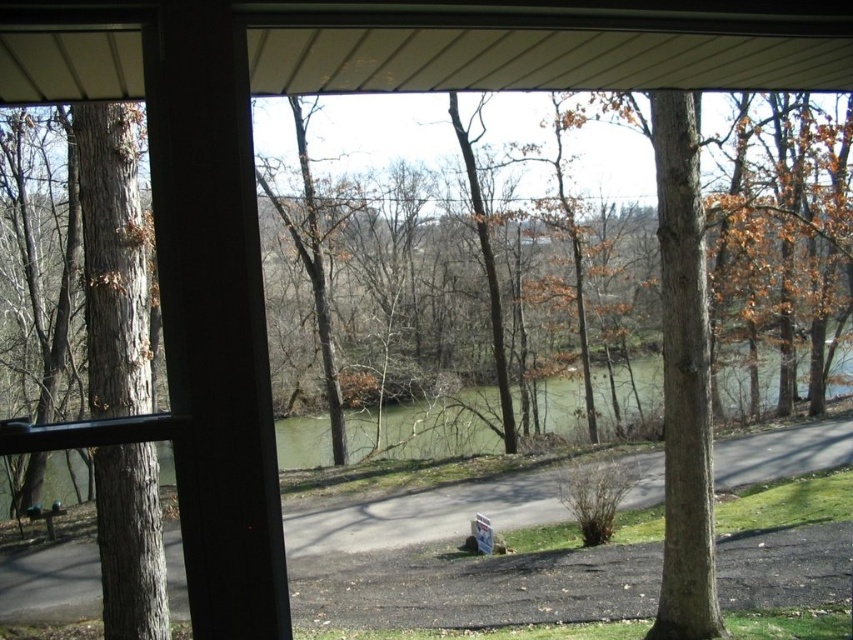
In the scene shown: You are standing inside a modern structure looking out through a window. You see a gray bark tree at left and a green grassy lake at center. Which object is closer to the window?

The gray bark tree at left is closer to the window because it is positioned over the green grassy lake at center, indicating it is in front of it.

You are sitting on the wooden park bench at lower left and want to walk to the green grassy lake at center. Which direction should you head towards?

You should head towards the right because the green grassy lake at center is positioned on the right side of the wooden park bench at lower left.